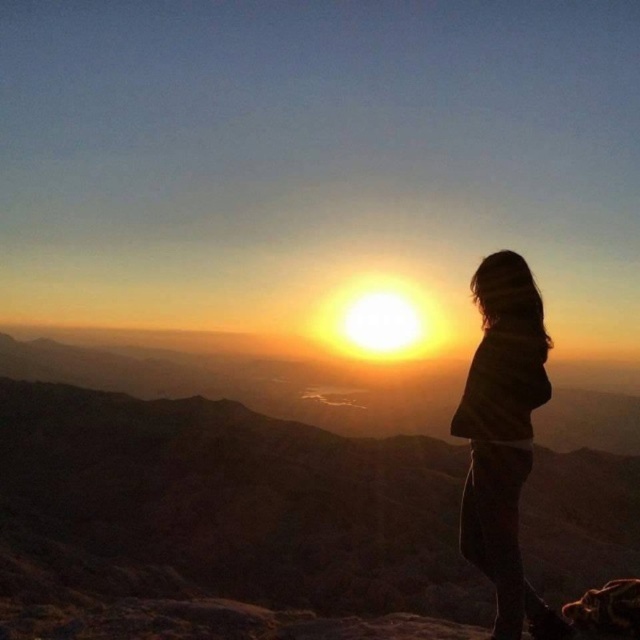
Does brown rocky mountain at center lie in front of brown textured sweater at right?

No, brown rocky mountain at center is further to the viewer.

Is brown rocky mountain at center bigger than brown textured sweater at right?

Yes, brown rocky mountain at center is bigger than brown textured sweater at right.

Based on the photo, who is more distant from viewer, (x=604, y=528) or (x=497, y=417)?

The point (x=604, y=528) is more distant.

This screenshot has width=640, height=640. I want to click on brown rocky mountain at center, so click(236, 502).